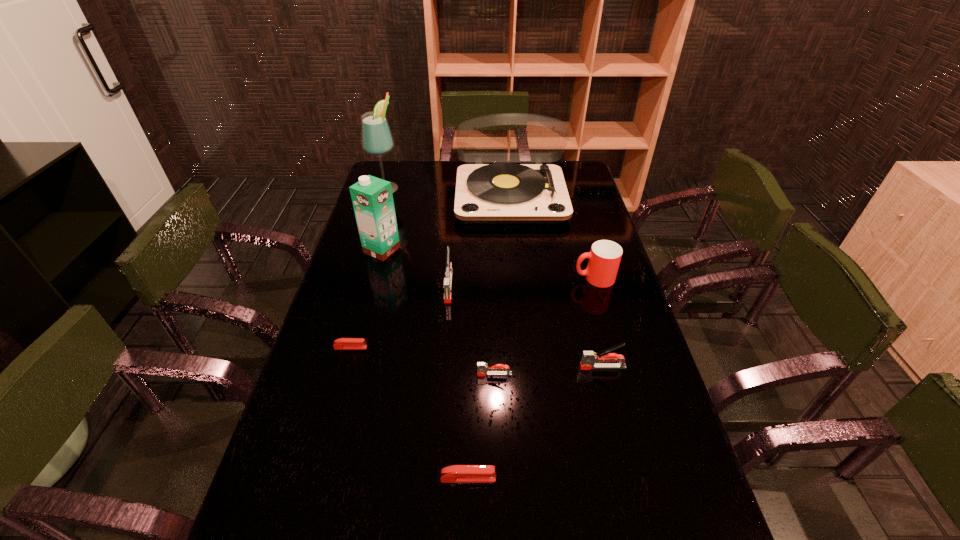
Find the location of a particular element. The width and height of the screenshot is (960, 540). the second gray stapler from left to right is located at coordinates (483, 369).

Where is `the right red stapler`? the right red stapler is located at coordinates (456, 473).

Identify the location of the bigger red stapler. (456, 473).

What are the coordinates of `the shortest object` in the screenshot? It's located at (342, 343).

The height and width of the screenshot is (540, 960). Identify the location of the leftmost stapler. (342, 343).

Identify the location of vacant position located on the back of the alcohol. Image resolution: width=960 pixels, height=540 pixels. (393, 167).

Image resolution: width=960 pixels, height=540 pixels. I want to click on blank space located with the tonearm facing the front of the record player, so click(x=518, y=275).

Where is `vacant point located on the right of the third tallest object`? The image size is (960, 540). vacant point located on the right of the third tallest object is located at coordinates (414, 250).

I want to click on vacant space located 0.190m on the handle side of the farthest stapler, so click(x=444, y=352).

At what (x,y) coordinates should I click in order to perform the action: click on free space located on the side of the red cup with the handle. Please return your answer as a coordinate pair (x, y). Looking at the image, I should click on (552, 278).